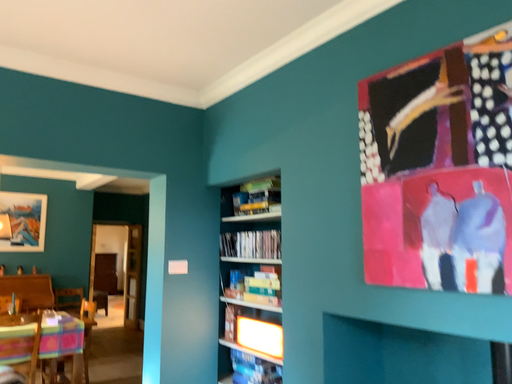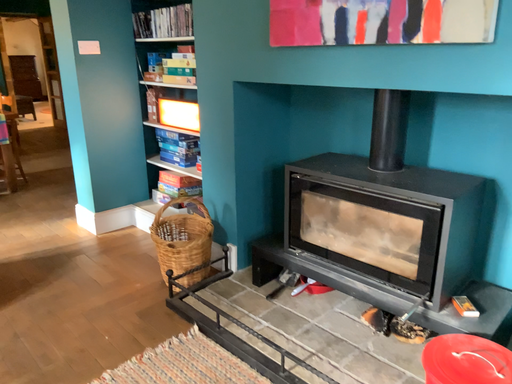
Question: Which way did the camera rotate in the video?

Choices:
 (A) rotated downward
 (B) rotated upward

Answer: (A)